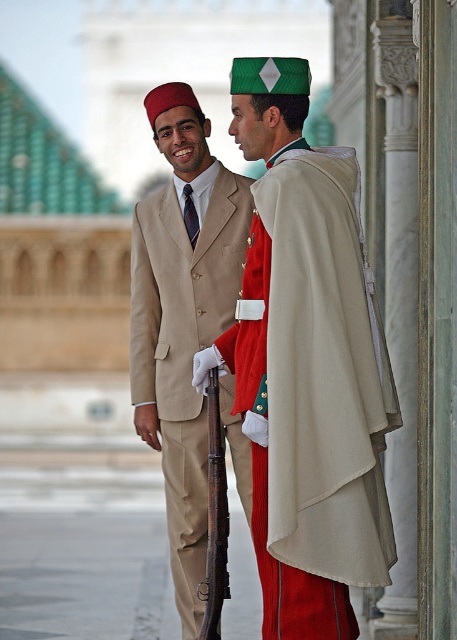
Question: Among these points, which one is nearest to the camera?

Choices:
 (A) (350, 401)
 (B) (175, 212)

Answer: (A)

Question: Can you confirm if matte beige suit at center is bigger than beige wool suit at center?

Choices:
 (A) yes
 (B) no

Answer: (B)

Question: Where is matte beige suit at center located in relation to beige wool suit at center in the image?

Choices:
 (A) above
 (B) below

Answer: (B)

Question: Which point is farther to the camera?

Choices:
 (A) matte beige suit at center
 (B) beige wool suit at center

Answer: (B)

Question: Which of the following is the farthest from the observer?

Choices:
 (A) beige wool suit at center
 (B) matte beige suit at center

Answer: (A)

Question: Can you confirm if matte beige suit at center is positioned to the right of beige wool suit at center?

Choices:
 (A) no
 (B) yes

Answer: (B)